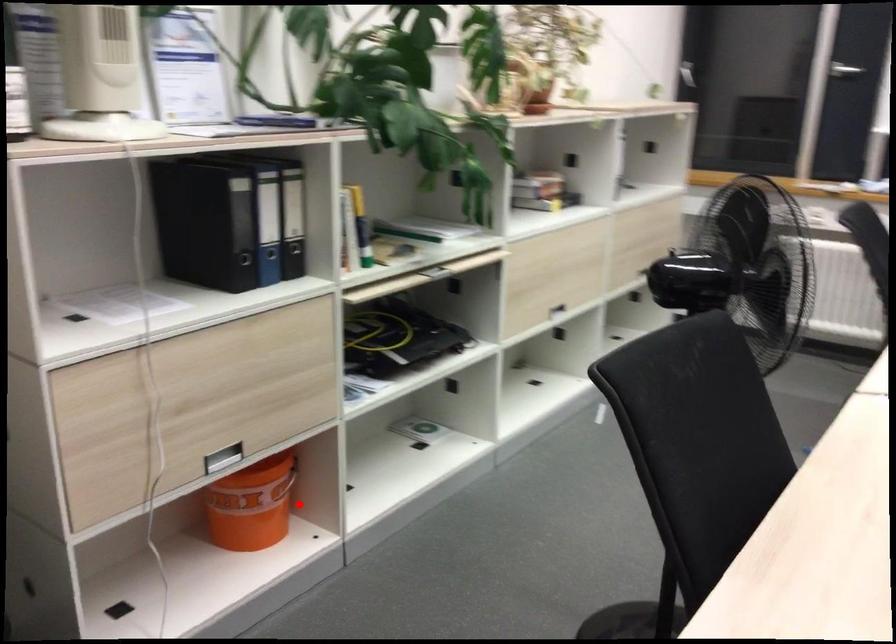
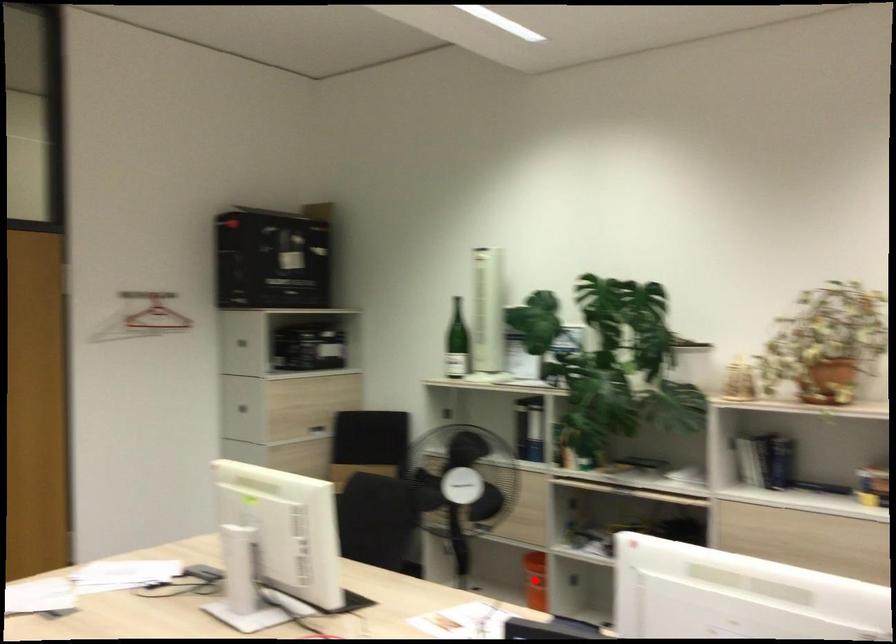
I am providing you with two images of the same scene from different viewpoints. A red point is marked on the first image and another point is marked on the second image. Does the point marked in image1 correspond to the same location as the one in image2?

Yes